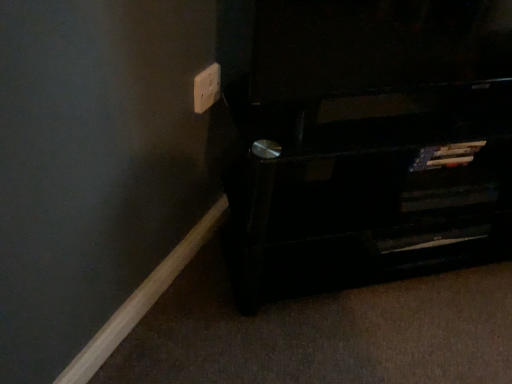
Question: Can you confirm if white plastic electric outlet at upper center is wider than black wood shelf at lower right?

Choices:
 (A) no
 (B) yes

Answer: (A)

Question: Considering the relative sizes of white plastic electric outlet at upper center and black wood shelf at lower right in the image provided, is white plastic electric outlet at upper center bigger than black wood shelf at lower right?

Choices:
 (A) no
 (B) yes

Answer: (A)

Question: Is white plastic electric outlet at upper center taller than black wood shelf at lower right?

Choices:
 (A) no
 (B) yes

Answer: (A)

Question: Are white plastic electric outlet at upper center and black wood shelf at lower right making contact?

Choices:
 (A) no
 (B) yes

Answer: (A)

Question: Could black wood shelf at lower right be considered to be inside white plastic electric outlet at upper center?

Choices:
 (A) no
 (B) yes

Answer: (A)

Question: Is white plastic electric outlet at upper center to the right of black wood shelf at lower right from the viewer's perspective?

Choices:
 (A) yes
 (B) no

Answer: (B)

Question: Is black wood shelf at lower right outside white plastic electric outlet at upper center?

Choices:
 (A) yes
 (B) no

Answer: (A)

Question: Is the surface of black wood shelf at lower right in direct contact with white plastic electric outlet at upper center?

Choices:
 (A) yes
 (B) no

Answer: (B)

Question: Is black wood shelf at lower right to the right of white plastic electric outlet at upper center from the viewer's perspective?

Choices:
 (A) yes
 (B) no

Answer: (A)

Question: Can you confirm if black wood shelf at lower right is wider than white plastic electric outlet at upper center?

Choices:
 (A) yes
 (B) no

Answer: (A)

Question: Is black wood shelf at lower right looking in the opposite direction of white plastic electric outlet at upper center?

Choices:
 (A) no
 (B) yes

Answer: (A)

Question: Does black wood shelf at lower right have a lesser width compared to white plastic electric outlet at upper center?

Choices:
 (A) yes
 (B) no

Answer: (B)

Question: Is point (202, 72) positioned closer to the camera than point (442, 62)?

Choices:
 (A) farther
 (B) closer

Answer: (A)